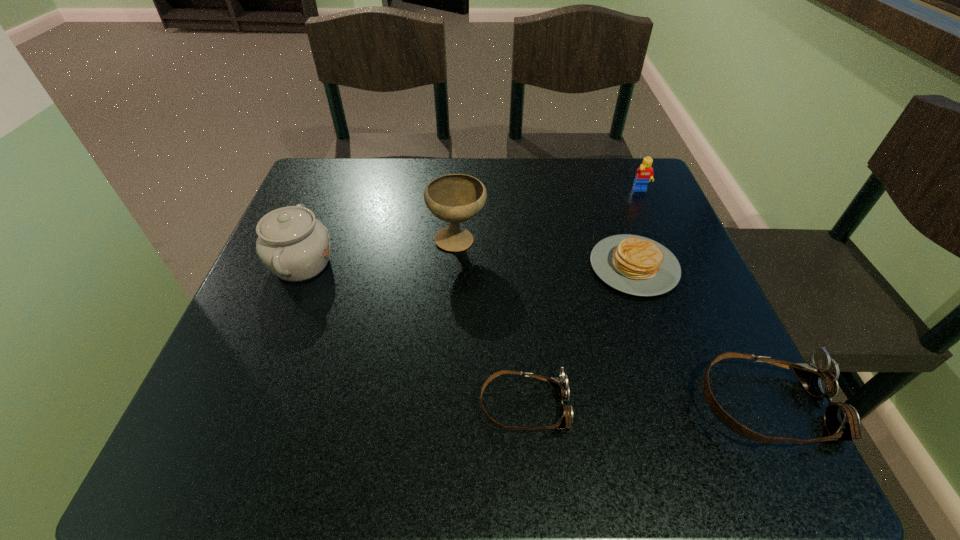
Where is `unoccupied area between the Lego and the chinaware`? The width and height of the screenshot is (960, 540). unoccupied area between the Lego and the chinaware is located at coordinates (471, 227).

Find the location of a particular element. free space between the shorter goggles and the chalice is located at coordinates click(491, 323).

The width and height of the screenshot is (960, 540). I want to click on unoccupied area between the chinaware and the shorter goggles, so coord(413,335).

The width and height of the screenshot is (960, 540). Find the location of `free space between the shorter goggles and the chinaware`. free space between the shorter goggles and the chinaware is located at coordinates (413, 335).

Locate an element on the screen. This screenshot has width=960, height=540. free area in between the pancake and the leftmost object is located at coordinates (468, 265).

Identify which object is the third nearest to the third tallest object. Please provide its 2D coordinates. Your answer should be formatted as a tuple, i.e. [(x, y)], where the tuple contains the x and y coordinates of a point satisfying the conditions above.

[(819, 377)]

Locate which object ranks fourth in proximity to the chinaware. Please provide its 2D coordinates. Your answer should be formatted as a tuple, i.e. [(x, y)], where the tuple contains the x and y coordinates of a point satisfying the conditions above.

[(819, 377)]

The image size is (960, 540). What are the coordinates of `blank area in the image that satisfies the following two spatial constraints: 1. on the front side of the pancake; 2. on the left side of the chalice` in the screenshot? It's located at (456, 266).

The image size is (960, 540). What are the coordinates of `blank area in the image that satisfies the following two spatial constraints: 1. on the face of the fourth shortest object; 2. on the front-facing side of the shorter goggles` in the screenshot? It's located at (734, 407).

The width and height of the screenshot is (960, 540). Find the location of `vacant space that satisfies the following two spatial constraints: 1. on the front side of the pancake; 2. on the front-facing side of the shorter goggles`. vacant space that satisfies the following two spatial constraints: 1. on the front side of the pancake; 2. on the front-facing side of the shorter goggles is located at coordinates [683, 407].